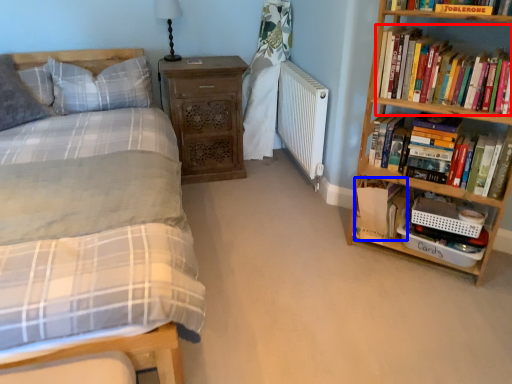
Question: Which of the following is the closest to the observer, book (highlighted by a red box) or book (highlighted by a blue box)?

Choices:
 (A) book
 (B) book

Answer: (A)